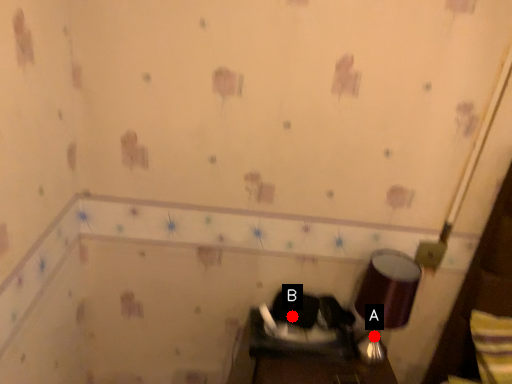
Question: Two points are circled on the image, labeled by A and B beside each circle. Among these points, which one is nearest to the camera?

Choices:
 (A) A is closer
 (B) B is closer

Answer: (B)